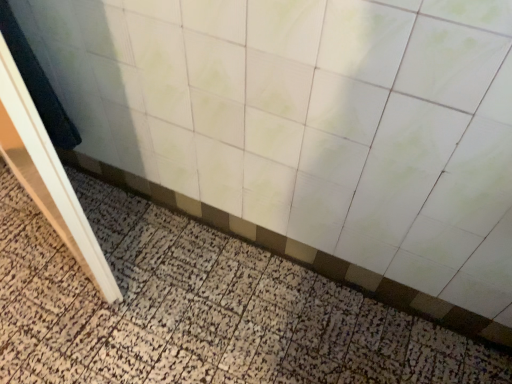
This screenshot has height=384, width=512. Describe the element at coordinates (199, 309) in the screenshot. I see `white speckled marble at lower center` at that location.

Identify the location of white speckled marble at lower center. The height and width of the screenshot is (384, 512). (199, 309).

Where is `white speckled marble at lower center`? white speckled marble at lower center is located at coordinates (199, 309).